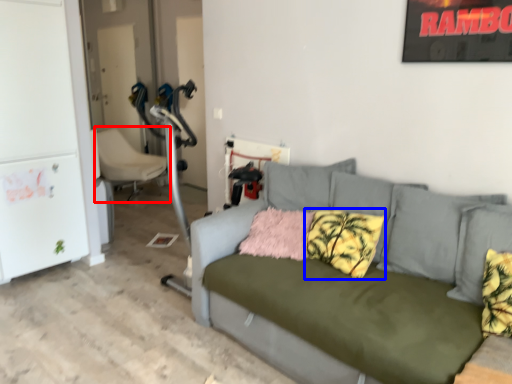
Question: Which of the following is the farthest to the observer, chair (highlighted by a red box) or pillow (highlighted by a blue box)?

Choices:
 (A) chair
 (B) pillow

Answer: (A)